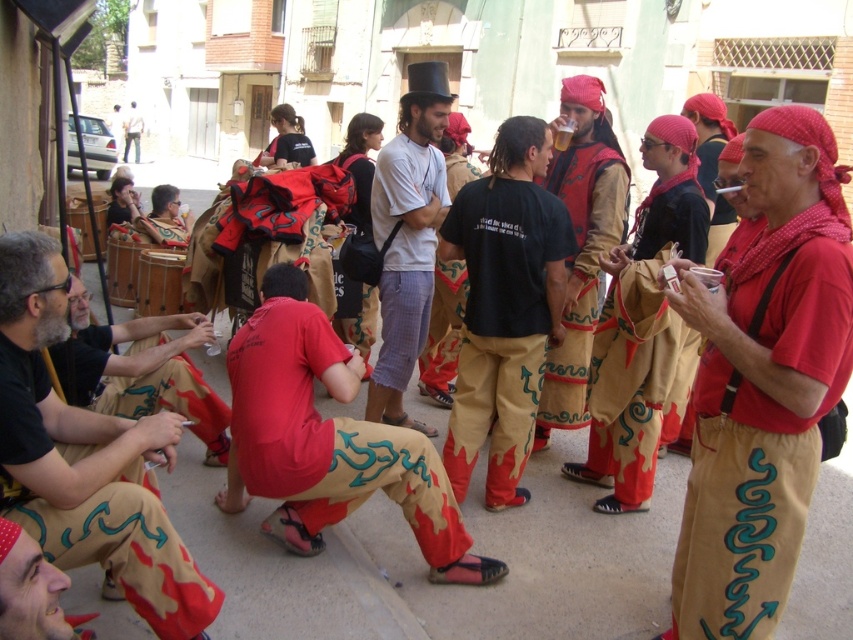
Consider the image. You are a photographer standing in the middle of the street. You want to take a photo of the red cotton headscarf at center and the matte black sunglasses at upper left. Which object should you focus on first if you want to capture both in a single frame without moving your camera?

The red cotton headscarf at center is taller than the matte black sunglasses at upper left, so you should focus on the red cotton headscarf at center first to ensure both objects are in the frame.

You are a photographer trying to capture the scene. You notice the red cotton headscarf at center and the matte khaki pants at lower left. Which object is positioned higher in the image?

The red cotton headscarf at center is located above the matte khaki pants at lower left, so it is positioned higher in the image.